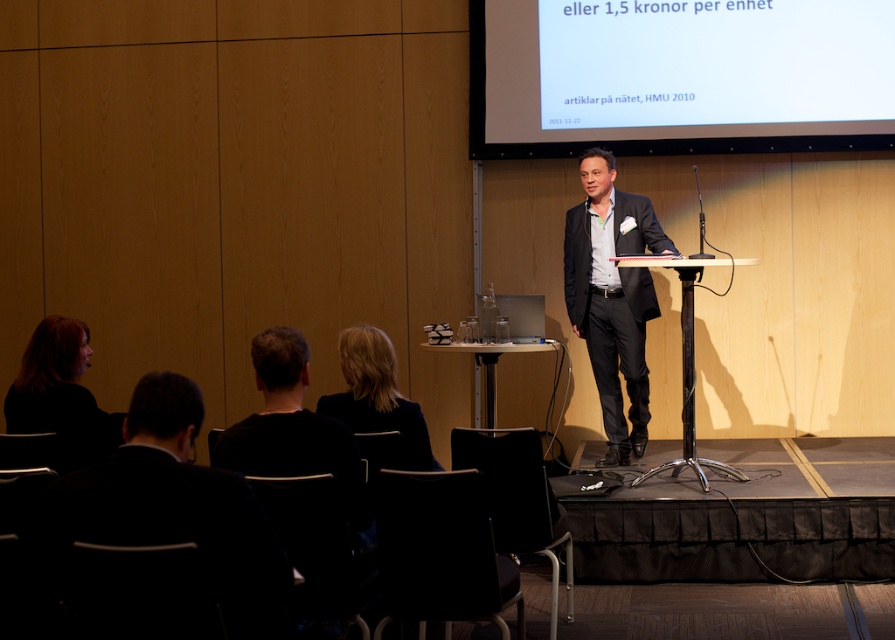
You are organizing a small workshop and need to seat two people in the front row. You have a black plastic chair at lower center and a metallic silver chair at lower center available. Which chair should you choose if you want to accommodate someone who needs more space?

The black plastic chair at lower center is bigger than the metallic silver chair at lower center, so you should choose the black plastic chair at lower center to accommodate someone who needs more space.

What is located at the point with coordinates (60, 394) in the image?

The point at coordinates (60, 394) contains dark hair at left.

You are sitting in the front row of the conference room and see the dark hair at left and the blonde hair at center. Which person is closer to you?

The dark hair at left is closer to you because it is further to the viewer than the blonde hair at center.